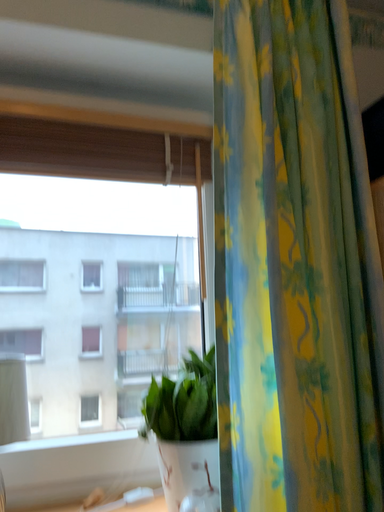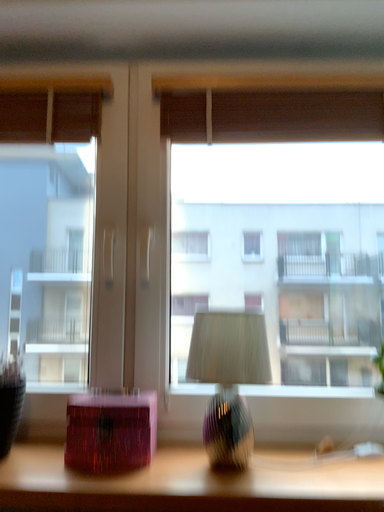
Question: How did the camera likely rotate when shooting the video?

Choices:
 (A) rotated left
 (B) rotated right

Answer: (A)